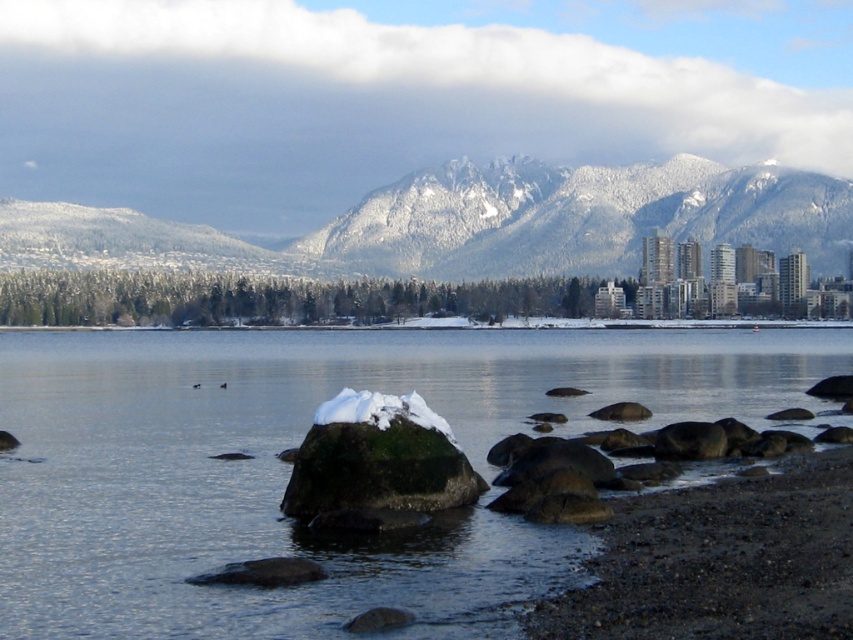
You are standing at the point marked as point (289,465) in the image. What do you see directly in front of you?

At point (289,465) lies clear water at center, so you would see clear water at center directly in front of you.

You are a hiker planning to reach the snowy granite mountains at upper center. You see a point marked at coordinates point (474, 224). Is this point located on the mountains?

Yes, the point (474, 224) is on the snowy granite mountains at upper center, so it is located on the mountains.